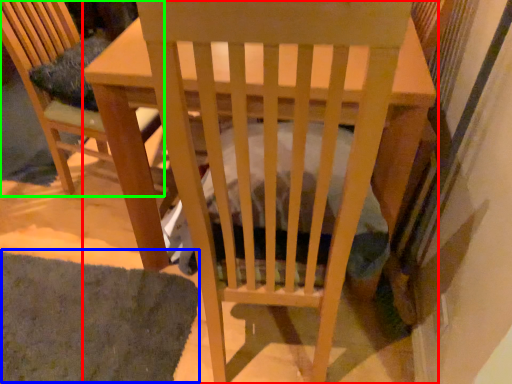
Question: Based on their relative distances, which object is nearer to table (highlighted by a red box)? Choose from mat (highlighted by a blue box) and chair (highlighted by a green box).

Choices:
 (A) mat
 (B) chair

Answer: (A)